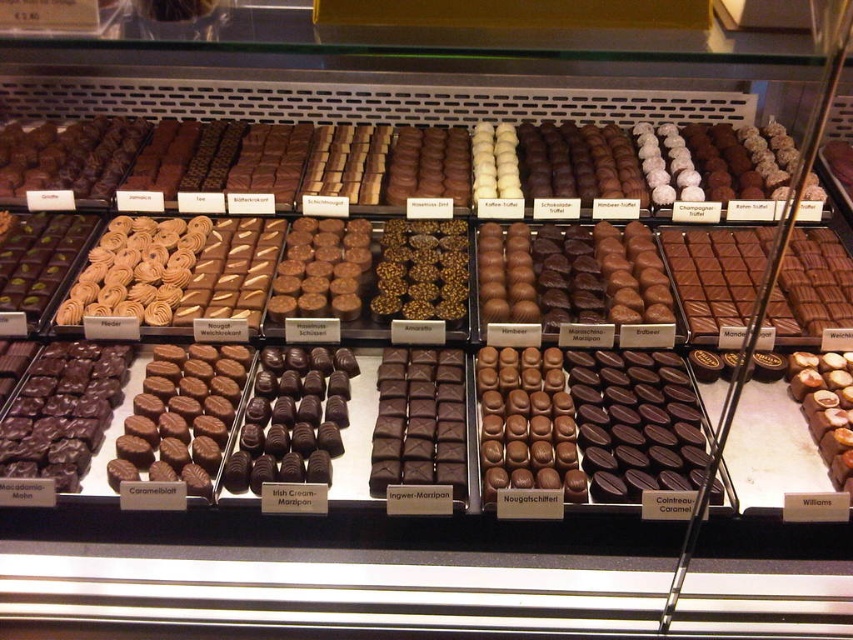
Question: From the image, what is the correct spatial relationship of shiny brown chocolate bar at right in relation to brown matte chocolate at center?

Choices:
 (A) below
 (B) above

Answer: (A)

Question: Estimate the real-world distances between objects in this image. Which object is farther from the shiny dark chocolate square at left?

Choices:
 (A) shiny chocolate truffle at center
 (B) brown chocolate truffle at right

Answer: (B)

Question: Considering the relative positions of matte chocolate nougat at center and brown chocolate truffle at right in the image provided, where is matte chocolate nougat at center located with respect to brown chocolate truffle at right?

Choices:
 (A) above
 (B) below

Answer: (A)

Question: Which of the following is the closest to the observer?

Choices:
 (A) matte chocolate nougat at center
 (B) shiny dark chocolate square at left
 (C) golden-brown crispy pastry at center-left

Answer: (B)

Question: Is shiny dark chocolate square at left positioned behind brown chocolate truffle at right?

Choices:
 (A) yes
 (B) no

Answer: (B)

Question: Based on their relative distances, which object is nearer to the shiny brown chocolate bar at right?

Choices:
 (A) brown matte chocolate at center
 (B) caramel brown chocolate at center

Answer: (A)